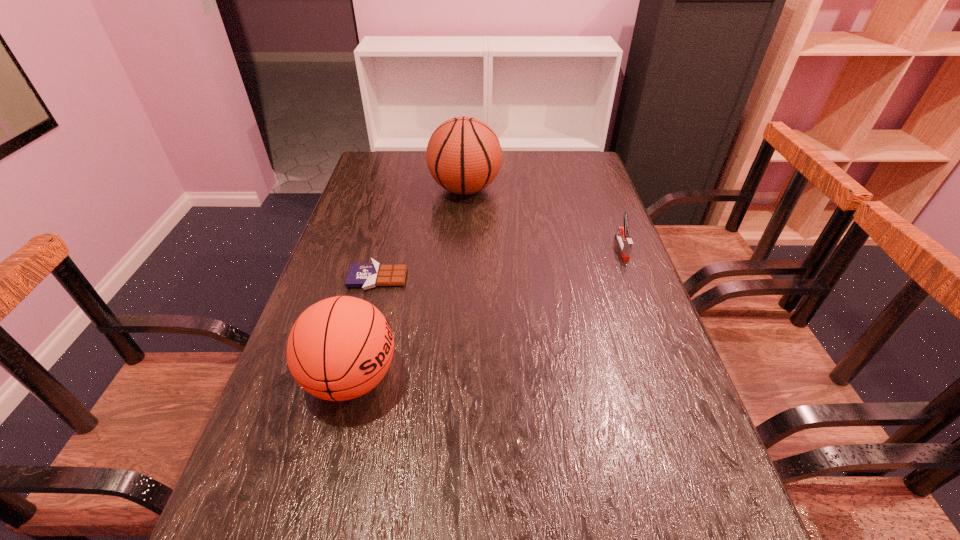
You are a GUI agent. You are given a task and a screenshot of the screen. Output one action in this format:
    pyautogui.click(x=<x>, y=<y>)
    Task: Click on the vacant space that's between the nearest object and the stapler
    This screenshot has width=960, height=540.
    Given the screenshot: What is the action you would take?
    pyautogui.click(x=487, y=313)

Where is `vacant area that lies between the chocolate bar and the taller basketball`? vacant area that lies between the chocolate bar and the taller basketball is located at coordinates (421, 234).

The height and width of the screenshot is (540, 960). In order to click on vacant area between the tallest object and the chocolate bar in this screenshot , I will do `click(421, 234)`.

You are a GUI agent. You are given a task and a screenshot of the screen. Output one action in this format:
    pyautogui.click(x=<x>, y=<y>)
    Task: Click on the free space between the nearer basketball and the stapler
    
    Given the screenshot: What is the action you would take?
    pyautogui.click(x=487, y=313)

Locate an element on the screen. This screenshot has height=540, width=960. free area in between the third shortest object and the rightmost object is located at coordinates (487, 313).

Find the location of `empty space between the second shortest object and the farthest object`. empty space between the second shortest object and the farthest object is located at coordinates coord(543,219).

I want to click on free space between the rightmost object and the third farthest object, so (x=499, y=263).

Identify the location of free spot between the second farthest object and the nearest object. (487, 313).

Locate an element on the screen. the closest object to the second shortest object is located at coordinates (463, 155).

Identify the location of the third closest object to the nearer basketball. The image size is (960, 540). (625, 243).